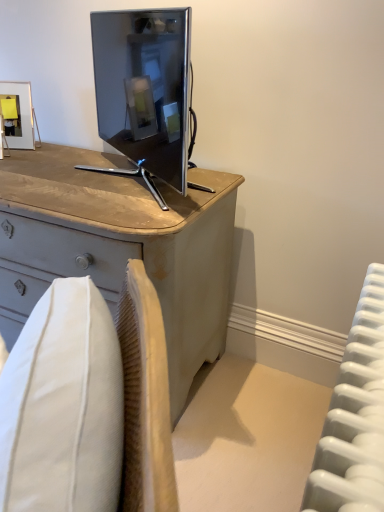
Question: Is light gray wood desk at center far from metallic gold picture frame at upper left?

Choices:
 (A) no
 (B) yes

Answer: (A)

Question: From the image's perspective, would you say light gray wood desk at center is positioned over metallic gold picture frame at upper left?

Choices:
 (A) yes
 (B) no

Answer: (B)

Question: Considering the relative sizes of light gray wood desk at center and metallic gold picture frame at upper left in the image provided, is light gray wood desk at center wider than metallic gold picture frame at upper left?

Choices:
 (A) no
 (B) yes

Answer: (B)

Question: Can you confirm if light gray wood desk at center is shorter than metallic gold picture frame at upper left?

Choices:
 (A) no
 (B) yes

Answer: (A)

Question: From a real-world perspective, is light gray wood desk at center under metallic gold picture frame at upper left?

Choices:
 (A) no
 (B) yes

Answer: (B)

Question: From a real-world perspective, is matte black tv at center physically located above or below metallic gold picture frame at upper left?

Choices:
 (A) below
 (B) above

Answer: (B)

Question: In terms of height, does matte black tv at center look taller or shorter compared to metallic gold picture frame at upper left?

Choices:
 (A) short
 (B) tall

Answer: (B)

Question: Looking at the image, does matte black tv at center seem bigger or smaller compared to metallic gold picture frame at upper left?

Choices:
 (A) big
 (B) small

Answer: (A)

Question: Is matte black tv at center wider or thinner than metallic gold picture frame at upper left?

Choices:
 (A) wide
 (B) thin

Answer: (A)

Question: Considering the positions of metallic gold picture frame at upper left and light gray wood desk at center in the image, is metallic gold picture frame at upper left taller or shorter than light gray wood desk at center?

Choices:
 (A) tall
 (B) short

Answer: (B)

Question: Is metallic gold picture frame at upper left wider or thinner than light gray wood desk at center?

Choices:
 (A) thin
 (B) wide

Answer: (A)

Question: Is metallic gold picture frame at upper left to the left or to the right of light gray wood desk at center in the image?

Choices:
 (A) right
 (B) left

Answer: (B)

Question: From the image's perspective, is metallic gold picture frame at upper left located above or below light gray wood desk at center?

Choices:
 (A) above
 (B) below

Answer: (A)

Question: Considering the positions of light gray wood desk at center and white plastic radiator at right in the image, is light gray wood desk at center wider or thinner than white plastic radiator at right?

Choices:
 (A) wide
 (B) thin

Answer: (A)

Question: From the image's perspective, is light gray wood desk at center above or below white plastic radiator at right?

Choices:
 (A) below
 (B) above

Answer: (B)